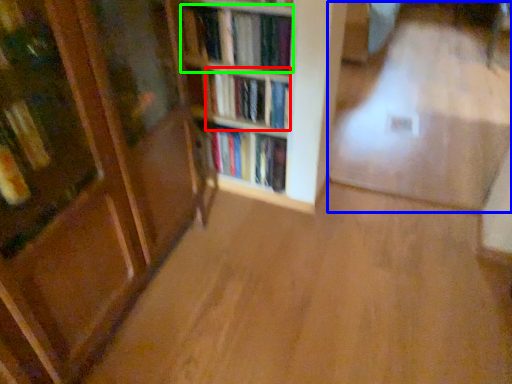
Question: Which object is positioned closest to book (highlighted by a red box)? Select from corridor (highlighted by a blue box) and book (highlighted by a green box).

Choices:
 (A) corridor
 (B) book

Answer: (B)